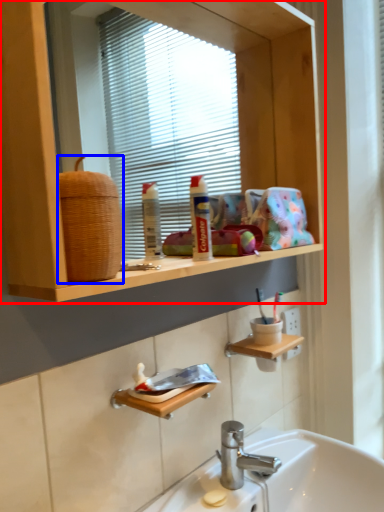
Question: Which object is further to the camera taking this photo, bathroom cabinet (highlighted by a red box) or basket (highlighted by a blue box)?

Choices:
 (A) bathroom cabinet
 (B) basket

Answer: (B)